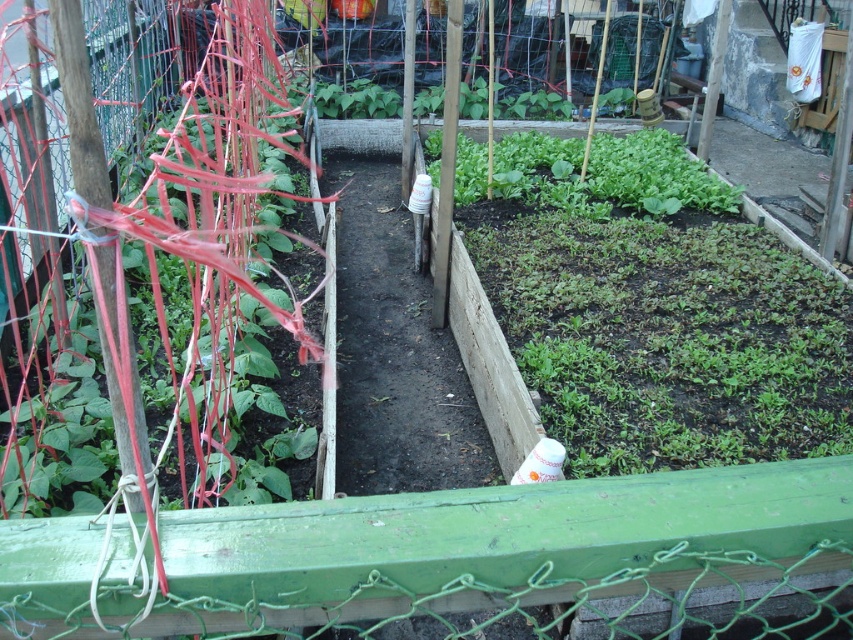
Can you confirm if green matte plant at left is shorter than green leafy at center?

No.

Does green matte plant at left have a lesser width compared to green leafy at center?

Yes, green matte plant at left is thinner than green leafy at center.

The image size is (853, 640). Identify the location of green matte plant at left. (157, 308).